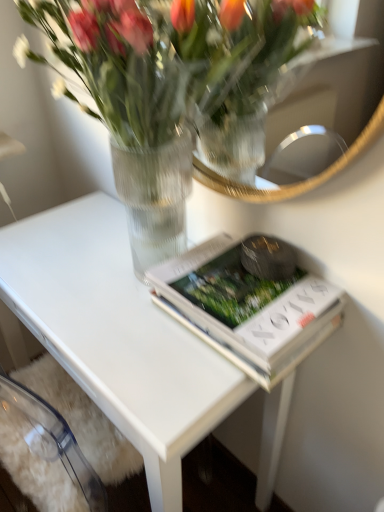
This screenshot has height=512, width=384. Describe the element at coordinates (175, 66) in the screenshot. I see `clear glass vase at upper center` at that location.

Identify the location of white matte book at center. The height and width of the screenshot is (512, 384). (247, 308).

Between white glossy table at center and white matte book at center, which one has less height?

white matte book at center is shorter.

Which is closer, [50,331] or [206,278]?

Point [206,278]

Can you confirm if white glossy table at center is smaller than white matte book at center?

No.

Based on the photo, is white glossy table at center in front of or behind white matte book at center in the image?

Visually, white glossy table at center is located in front of white matte book at center.

Is clear glass vase at upper center looking in the opposite direction of white matte book at center?

That's not correct — clear glass vase at upper center is not looking away from white matte book at center.

From a real-world perspective, which object stands above the other?

clear glass vase at upper center.

Between clear glass vase at upper center and white matte book at center, which one has smaller size?

With smaller size is white matte book at center.

Identify the location of houseplant that appears above the white matte book at center (from the image's perspective). The width and height of the screenshot is (384, 512). (175, 66).

Does white glossy table at center have a lesser height compared to clear glass vase at upper center?

No, white glossy table at center is not shorter than clear glass vase at upper center.

In the scene shown: Is white glossy table at center turned away from clear glass vase at upper center?

No, white glossy table at center is not facing the opposite direction of clear glass vase at upper center.

In terms of width, does white glossy table at center look wider or thinner when compared to clear glass vase at upper center?

In the image, white glossy table at center appears to be wider than clear glass vase at upper center.

From the image's perspective, between white glossy table at center and clear glass vase at upper center, which one is located above?

From the image's view, clear glass vase at upper center is above.

From the image's perspective, is white matte book at center positioned above or below white glossy table at center?

Clearly, from the image's perspective, white matte book at center is above white glossy table at center.

Which object is positioned more to the right, white matte book at center or white glossy table at center?

white matte book at center.

Is white glossy table at center inside white matte book at center?

No.

Is clear glass vase at upper center at the right side of white glossy table at center?

Correct, you'll find clear glass vase at upper center to the right of white glossy table at center.

Considering the sizes of clear glass vase at upper center and white glossy table at center in the image, is clear glass vase at upper center bigger or smaller than white glossy table at center?

Clearly, clear glass vase at upper center is smaller in size than white glossy table at center.

Does clear glass vase at upper center have a greater width compared to white glossy table at center?

In fact, clear glass vase at upper center might be narrower than white glossy table at center.

From a real-world perspective, who is located higher, clear glass vase at upper center or white glossy table at center?

From a 3D spatial view, clear glass vase at upper center is above.

How different are the orientations of white matte book at center and clear glass vase at upper center in degrees?

0.000102 degrees separate the facing orientations of white matte book at center and clear glass vase at upper center.

From a real-world perspective, is white matte book at center positioned under clear glass vase at upper center based on gravity?

Yes, from a real-world perspective, white matte book at center is below clear glass vase at upper center.

Is white matte book at center in front of or behind clear glass vase at upper center in the image?

white matte book at center is positioned farther from the viewer than clear glass vase at upper center.

Between white matte book at center and clear glass vase at upper center, which one has more height?

clear glass vase at upper center is taller.

The image size is (384, 512). In order to click on table to the left of white matte book at center in this screenshot , I will do `click(117, 336)`.

This screenshot has width=384, height=512. Identify the location of paperback book below the clear glass vase at upper center (from a real-world perspective). (247, 308).

When comparing their distances from clear glass vase at upper center, does white glossy table at center or white matte book at center seem closer?

white matte book at center.

Considering their positions, is clear glass vase at upper center positioned closer to white matte book at center than white glossy table at center?

The object closer to white matte book at center is white glossy table at center.

From the image, which object appears to be farther from white glossy table at center, white matte book at center or clear glass vase at upper center?

Based on the image, clear glass vase at upper center appears to be further to white glossy table at center.

Estimate the real-world distances between objects in this image. Which object is further from white glossy table at center, clear glass vase at upper center or white matte book at center?

Based on the image, clear glass vase at upper center appears to be further to white glossy table at center.

Considering their positions, is white matte book at center positioned closer to clear glass vase at upper center than white glossy table at center?

white matte book at center lies closer to clear glass vase at upper center than the other object.

Based on their spatial positions, is white glossy table at center or clear glass vase at upper center further from white matte book at center?

clear glass vase at upper center is positioned further to the anchor white matte book at center.

Locate an element on the screen. The image size is (384, 512). paperback book between clear glass vase at upper center and white glossy table at center from top to bottom is located at coordinates (247, 308).